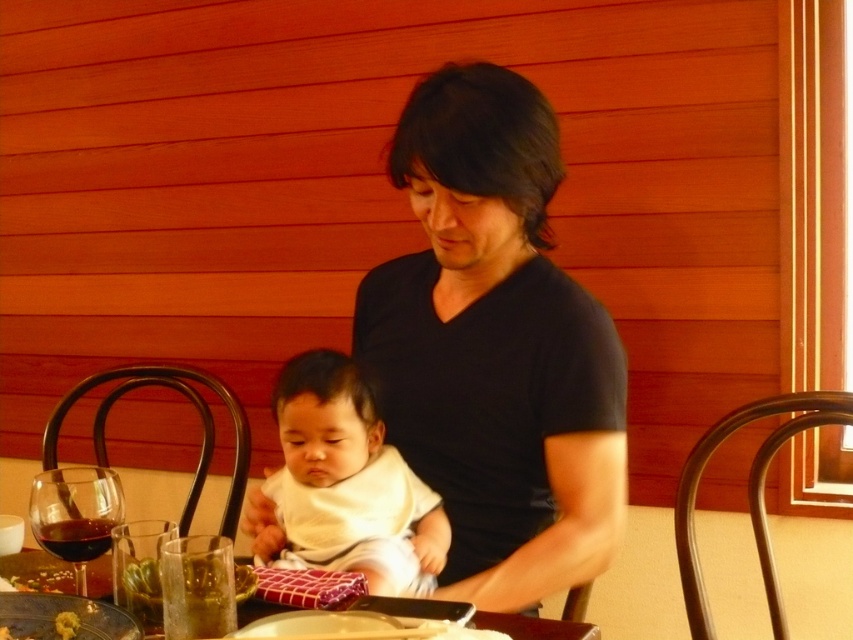
You are standing at the center of the dining table. You want to reach the point marked at coordinates point (74, 515). Is this point located near the translucent glass wine at lower left?

Yes, the point (74, 515) is located near the translucent glass wine at lower left as it marks the exact location of the wine.

What is located at the coordinates point (346,484) in the image?

The point (346,484) corresponds to the white soft baby at center.

You are setting up a table for a dinner party and need to place a decorative centerpiece. The centerpiece requires a space that is wider than the dark red glass at lower left. Do you have enough space between the translucent glass wine at lower left and the edge of the table to accommodate it?

The translucent glass wine at lower left has a larger width than the dark red glass at lower left. Therefore, the space between the translucent glass wine at lower left and the edge of the table is sufficient to accommodate the centerpiece that requires a width larger than the dark red glass at lower left.